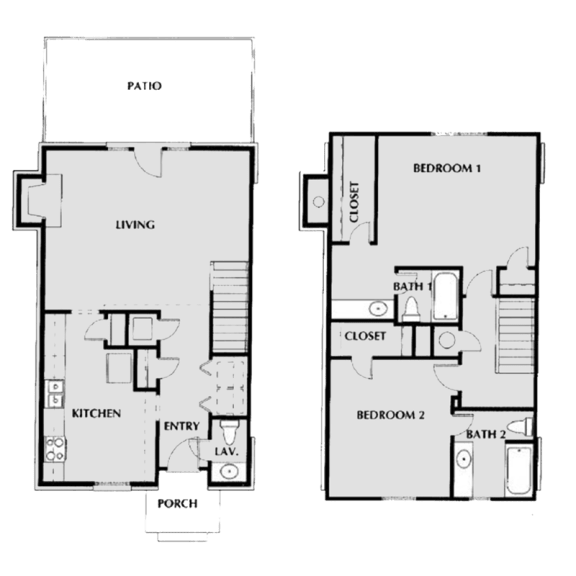
Locate an element on the screen. patio doorway is located at coordinates (153, 151).